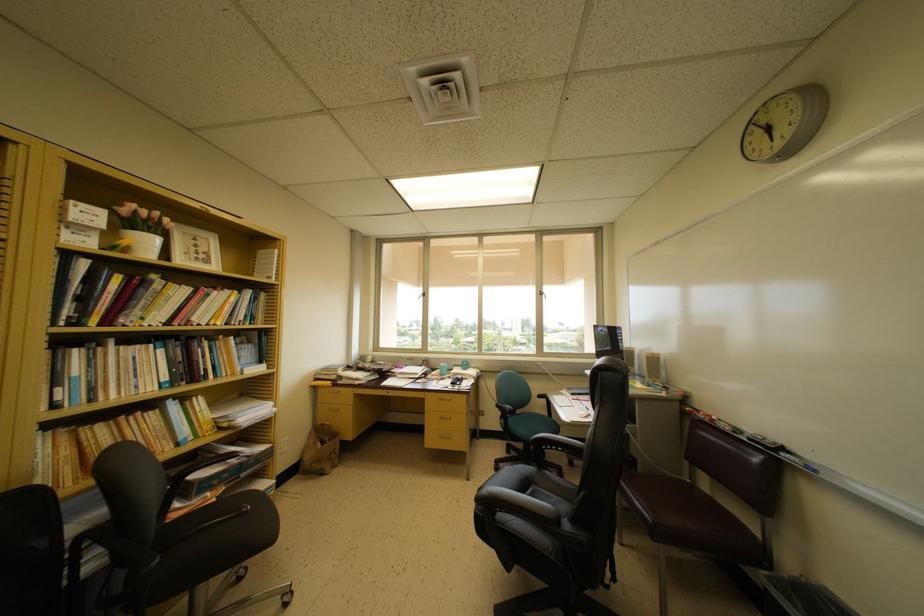
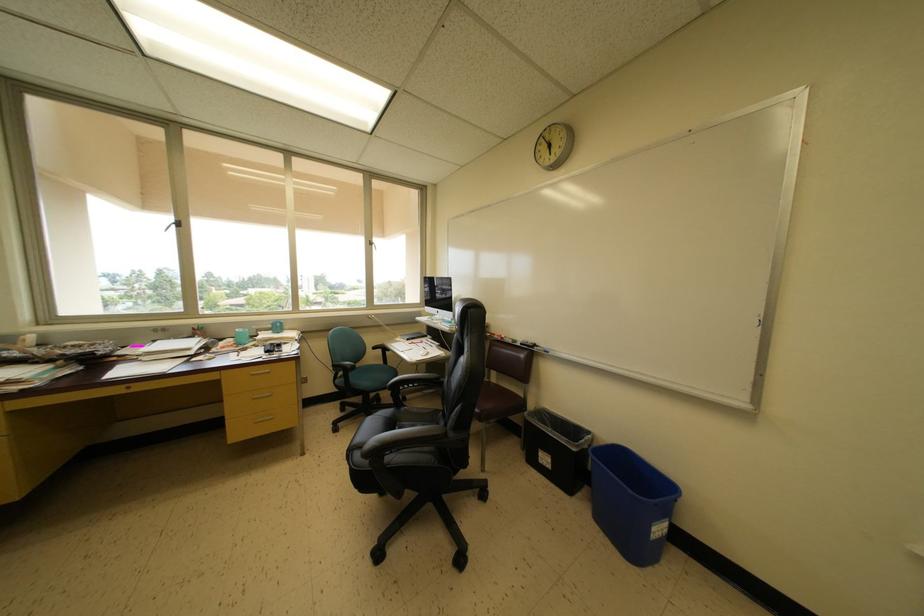
The point at (786, 454) is marked in the first image. Where is the corresponding point in the second image?

(539, 350)